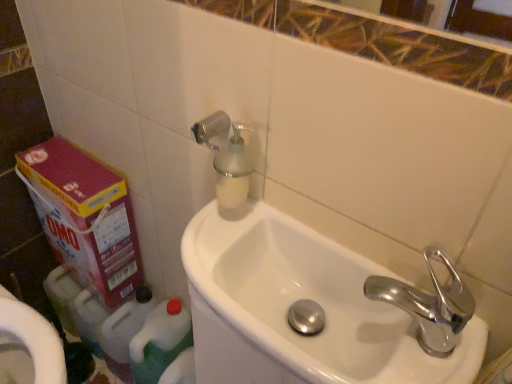
Question: Considering the positions of point click(x=110, y=187) and point click(x=246, y=190), is point click(x=110, y=187) closer or farther from the camera than point click(x=246, y=190)?

Choices:
 (A) farther
 (B) closer

Answer: (A)

Question: Visually, is pink cardboard box at lower left positioned to the left or to the right of silver metallic soap dispenser at upper center?

Choices:
 (A) left
 (B) right

Answer: (A)

Question: Which object is the farthest from the chrome metallic faucet at right?

Choices:
 (A) silver metallic soap dispenser at upper center
 (B) white glossy sink at center
 (C) pink cardboard box at lower left
 (D) green plastic bottle at lower left, the first cleaning product positioned from the left
 (E) green plastic bottle at lower left, which ranks as the 1th cleaning product in right-to-left order

Answer: (D)

Question: Which object is positioned closest to the white glossy sink at center?

Choices:
 (A) green plastic bottle at lower left, which is the 2th cleaning product in left-to-right order
 (B) silver metallic soap dispenser at upper center
 (C) chrome metallic faucet at right
 (D) pink cardboard box at lower left
 (E) green plastic bottle at lower left, which ranks as the 2th cleaning product in right-to-left order

Answer: (C)